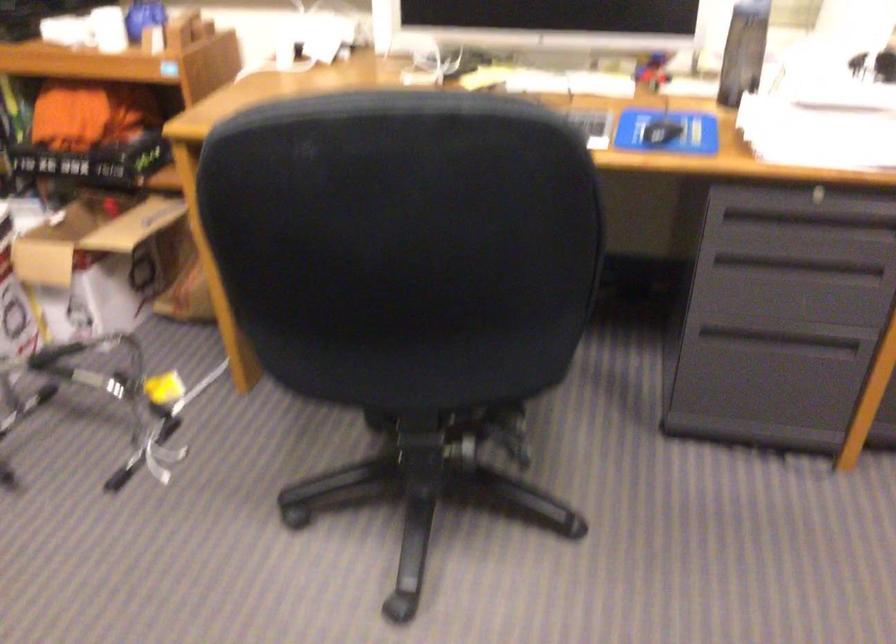
You are a GUI agent. You are given a task and a screenshot of the screen. Output one action in this format:
    pyautogui.click(x=<x>, y=<y>)
    Task: Click on the cardboard box
    This screenshot has width=896, height=644.
    Given the screenshot: What is the action you would take?
    pyautogui.click(x=99, y=263)